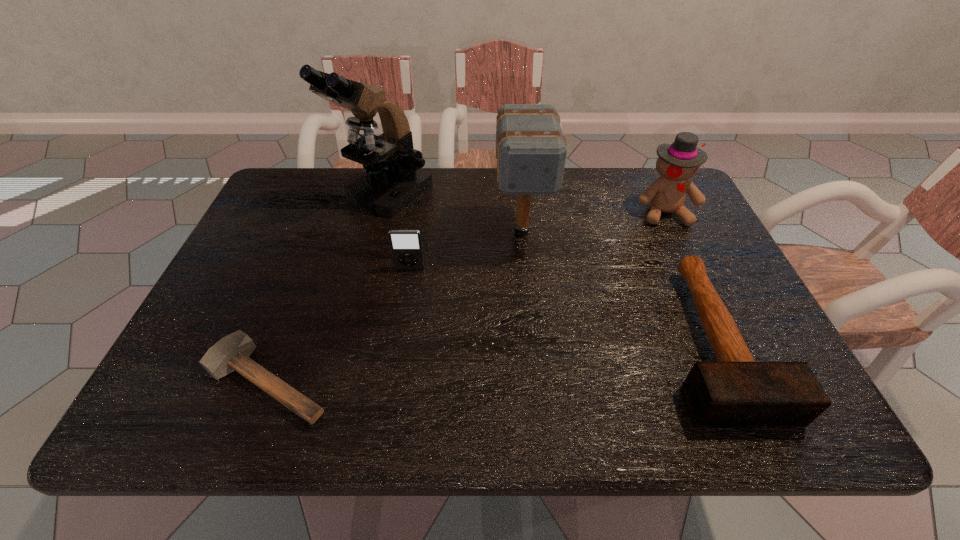
Find the location of a particular element. The width and height of the screenshot is (960, 540). the closest mallet to the shortest mallet is located at coordinates (531, 150).

Point out which mallet is positioned as the third nearest to the third shortest object. Please provide its 2D coordinates. Your answer should be formatted as a tuple, i.e. [(x, y)], where the tuple contains the x and y coordinates of a point satisfying the conditions above.

[(736, 391)]

Where is `free spot that satisfies the following two spatial constraints: 1. on the back side of the microscope; 2. on the right side of the shortest mallet`? free spot that satisfies the following two spatial constraints: 1. on the back side of the microscope; 2. on the right side of the shortest mallet is located at coordinates (338, 196).